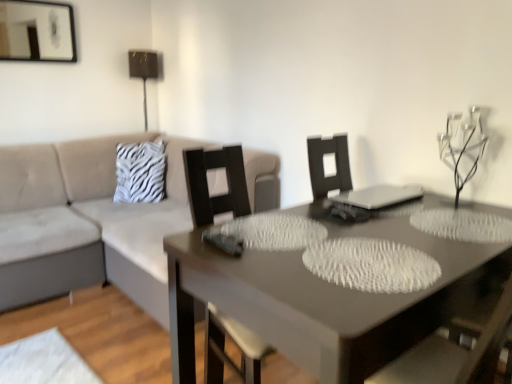
Looking at this image, measure the distance between point (442, 145) and camera.

6.53 feet.

What is the approximate height of metallic gold table lamp at upper center?

Answer: 30.69 inches.

This screenshot has height=384, width=512. Find the location of `white zebra print pillow at upper left`. white zebra print pillow at upper left is located at coordinates (140, 172).

This screenshot has height=384, width=512. I want to click on beige fabric couch at left, so click(94, 221).

This screenshot has height=384, width=512. Identify the location of clear glass candle holder at upper right. (462, 146).

Is metallic gold table lamp at upper center thinner than matte black picture frame at upper left?

In fact, metallic gold table lamp at upper center might be wider than matte black picture frame at upper left.

Can you see metallic gold table lamp at upper center touching matte black picture frame at upper left?

No, metallic gold table lamp at upper center is not touching matte black picture frame at upper left.

From a real-world perspective, is metallic gold table lamp at upper center on matte black picture frame at upper left?

Actually, metallic gold table lamp at upper center is physically below matte black picture frame at upper left in the real world.

Between point (148, 60) and point (42, 55), which one is positioned behind?

The point (148, 60) is farther.

Which of these two, beige fabric couch at left or clear glass candle holder at upper right, stands shorter?

With less height is clear glass candle holder at upper right.

What's the angular difference between beige fabric couch at left and clear glass candle holder at upper right's facing directions?

The angle between the facing direction of beige fabric couch at left and the facing direction of clear glass candle holder at upper right is 2.01 degrees.

From the image's perspective, is beige fabric couch at left under clear glass candle holder at upper right?

Correct, beige fabric couch at left appears lower than clear glass candle holder at upper right in the image.

Is beige fabric couch at left not close to clear glass candle holder at upper right?

beige fabric couch at left is positioned a significant distance from clear glass candle holder at upper right.

From a real-world perspective, relative to matte black picture frame at upper left, is smooth gray table at center vertically above or below?

In terms of real-world spatial position, smooth gray table at center is below matte black picture frame at upper left.

From the image's perspective, does smooth gray table at center appear lower than matte black picture frame at upper left?

Yes.

Can you confirm if smooth gray table at center is wider than matte black picture frame at upper left?

Indeed, smooth gray table at center has a greater width compared to matte black picture frame at upper left.

Is the position of smooth gray table at center less distant than that of beige fabric couch at left?

Yes, it is.

From a real-world perspective, is smooth gray table at center located higher than beige fabric couch at left?

No, from a real-world perspective, smooth gray table at center is not on top of beige fabric couch at left.

Can you confirm if smooth gray table at center is wider than beige fabric couch at left?

No.

Considering the relative sizes of smooth gray table at center and beige fabric couch at left in the image provided, is smooth gray table at center shorter than beige fabric couch at left?

Correct, smooth gray table at center is not as tall as beige fabric couch at left.

Is white zebra print pillow at upper left spatially inside matte black picture frame at upper left, or outside of it?

white zebra print pillow at upper left is not enclosed by matte black picture frame at upper left.

Can you confirm if white zebra print pillow at upper left is taller than matte black picture frame at upper left?

In fact, white zebra print pillow at upper left may be shorter than matte black picture frame at upper left.

Between point (121, 181) and point (21, 4), which one is positioned behind?

The point (121, 181) is behind.

Can you see smooth gray table at center touching metallic gold table lamp at upper center?

No, smooth gray table at center is not touching metallic gold table lamp at upper center.

Is point (350, 315) closer to camera compared to point (144, 122)?

Yes, it is in front of point (144, 122).

Can you tell me how much smooth gray table at center and metallic gold table lamp at upper center differ in facing direction?

There is a 1.83-degree angle between the facing directions of smooth gray table at center and metallic gold table lamp at upper center.

Who is shorter, smooth gray table at center or metallic gold table lamp at upper center?

With less height is metallic gold table lamp at upper center.

Considering the sizes of objects clear glass candle holder at upper right and beige fabric couch at left in the image provided, who is thinner, clear glass candle holder at upper right or beige fabric couch at left?

With smaller width is clear glass candle holder at upper right.

Between clear glass candle holder at upper right and beige fabric couch at left, which one appears on the left side from the viewer's perspective?

beige fabric couch at left is more to the left.

Which point is more forward, (439, 139) or (102, 254)?

Point (439, 139)

Does clear glass candle holder at upper right lie behind beige fabric couch at left?

No, clear glass candle holder at upper right is closer to the camera.

Identify the location of picture frame in front of the metallic gold table lamp at upper center. (37, 31).

Identify the location of studio couch below the clear glass candle holder at upper right (from a real-world perspective). (94, 221).

Which object lies nearer to the anchor point white zebra print pillow at upper left, beige fabric couch at left or matte black picture frame at upper left?

beige fabric couch at left is closer to white zebra print pillow at upper left.

When comparing their distances from matte black picture frame at upper left, does beige fabric couch at left or white zebra print pillow at upper left seem closer?

white zebra print pillow at upper left is closer to matte black picture frame at upper left.

Estimate the real-world distances between objects in this image. Which object is further from metallic gold table lamp at upper center, matte black picture frame at upper left or beige fabric couch at left?

beige fabric couch at left lies further to metallic gold table lamp at upper center than the other object.

Estimate the real-world distances between objects in this image. Which object is further from metallic gold table lamp at upper center, matte black picture frame at upper left or smooth gray table at center?

Among the two, smooth gray table at center is located further to metallic gold table lamp at upper center.

Considering their positions, is beige fabric couch at left positioned closer to matte black picture frame at upper left than smooth gray table at center?

The object closer to matte black picture frame at upper left is beige fabric couch at left.

Looking at the image, which one is located further to beige fabric couch at left, matte black picture frame at upper left or clear glass candle holder at upper right?

The object further to beige fabric couch at left is clear glass candle holder at upper right.

Which object lies nearer to the anchor point white zebra print pillow at upper left, smooth gray table at center or beige fabric couch at left?

Based on the image, beige fabric couch at left appears to be nearer to white zebra print pillow at upper left.

From the image, which object appears to be farther from beige fabric couch at left, white zebra print pillow at upper left or metallic gold table lamp at upper center?

metallic gold table lamp at upper center is positioned further to the anchor beige fabric couch at left.

Locate an element on the screen. This screenshot has height=384, width=512. studio couch located between clear glass candle holder at upper right and metallic gold table lamp at upper center in the depth direction is located at coordinates (94, 221).

This screenshot has width=512, height=384. What are the coordinates of `table between matte black picture frame at upper left and clear glass candle holder at upper right` in the screenshot? It's located at (325, 298).

This screenshot has width=512, height=384. I want to click on picture frame between smooth gray table at center and metallic gold table lamp at upper center from front to back, so click(37, 31).

Locate an element on the screen. studio couch between smooth gray table at center and metallic gold table lamp at upper center in the front-back direction is located at coordinates (94, 221).